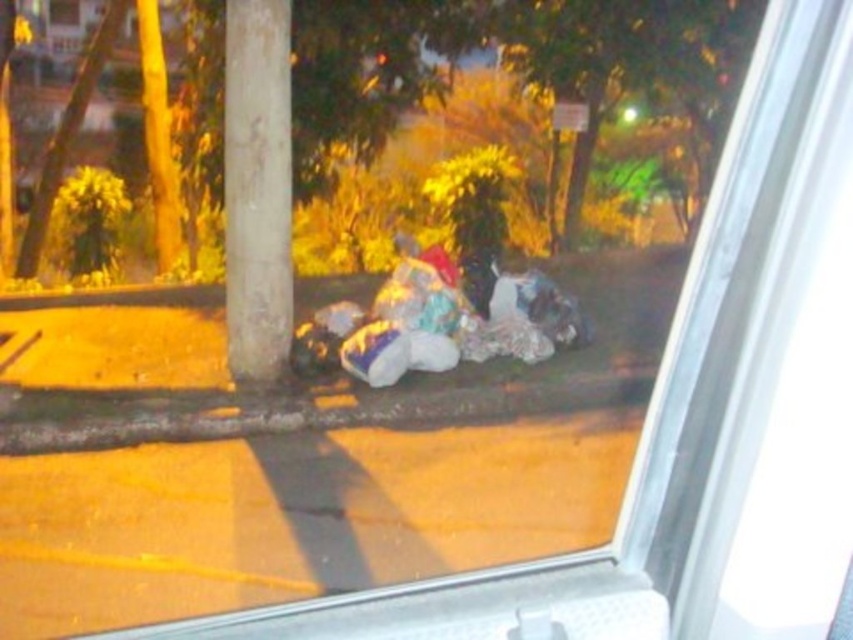
Is point (664, 90) less distant than point (349, 355)?

No.

Where is `green leafy tree at center`? The height and width of the screenshot is (640, 853). green leafy tree at center is located at coordinates (523, 74).

Can you confirm if white textured pole at center is taller than fuzzy fabric pile at center?

Indeed, white textured pole at center has a greater height compared to fuzzy fabric pile at center.

Who is taller, white textured pole at center or fuzzy fabric pile at center?

white textured pole at center

Find the location of a particular element. The width and height of the screenshot is (853, 640). white textured pole at center is located at coordinates (257, 188).

Can you confirm if green leafy tree at center is taller than white textured pole at center?

No.

From the picture: Can you confirm if green leafy tree at center is bigger than white textured pole at center?

Incorrect, green leafy tree at center is not larger than white textured pole at center.

Between point (659, 168) and point (262, 24), which one is positioned in front?

Point (262, 24) is more forward.

At what (x,y) coordinates should I click in order to perform the action: click on green leafy tree at center. Please return your answer as a coordinate pair (x, y). Looking at the image, I should click on (523, 74).